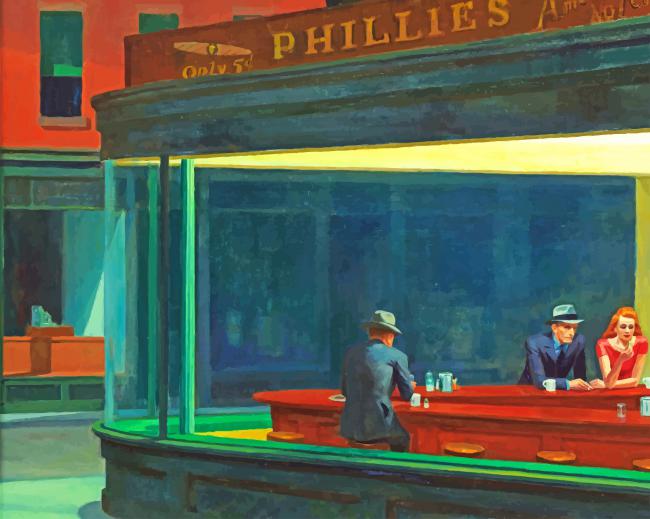
At what (x,y) coordinates should I click in order to perform the action: click on coffee cups. Please return your answer as a coordinate pair (x, y). Looking at the image, I should click on (547, 386), (645, 379), (418, 403).